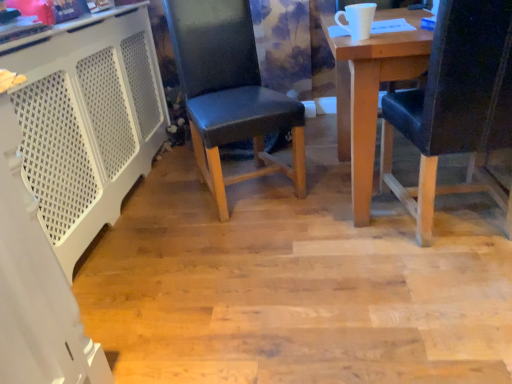
Locate an element on the screen. space that is in front of black leather chair at right, which is counted as the 2th chair, starting from the left is located at coordinates (451, 307).